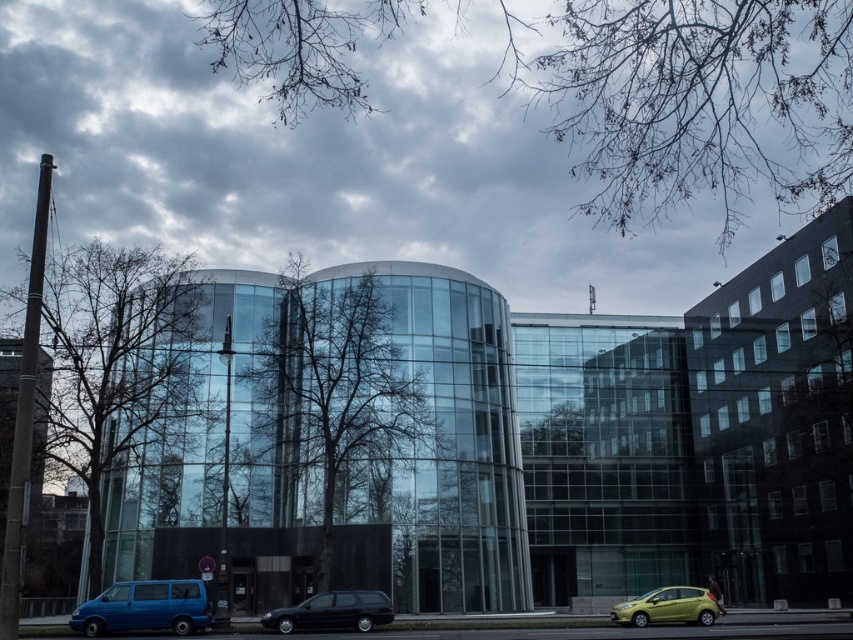
You are a delivery person who needs to park your 4.5 meter long truck between the shiny black station wagon at lower center and the metallic yellow car at lower right. Can you fit your truck there without overlapping either vehicle?

The distance between the shiny black station wagon at lower center and the metallic yellow car at lower right is 12.45 meters. Since your truck is only 4.5 meters long, there is more than enough space to park it between them without overlapping either vehicle.

You are standing in front of a modern building with a glass facade. You want to take a photo of the point at coordinates point (209, 611). If your camera can focus up to 25 meters, will you be able to capture the point clearly?

The distance of point (209, 611) from the camera is 26.32 meters, which is beyond the camera focus limit of 25 meters. Therefore, you won not be able to capture the point clearly.